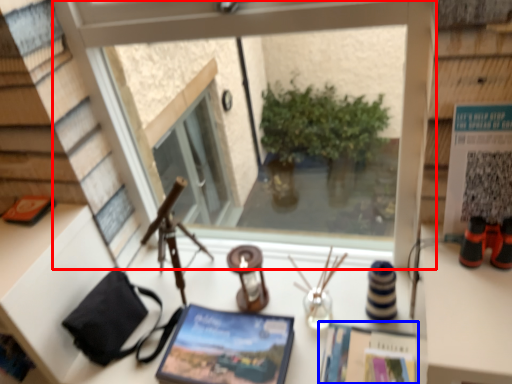
Question: Among these objects, which one is farthest to the camera, window (highlighted by a red box) or magazine (highlighted by a blue box)?

Choices:
 (A) window
 (B) magazine

Answer: (B)